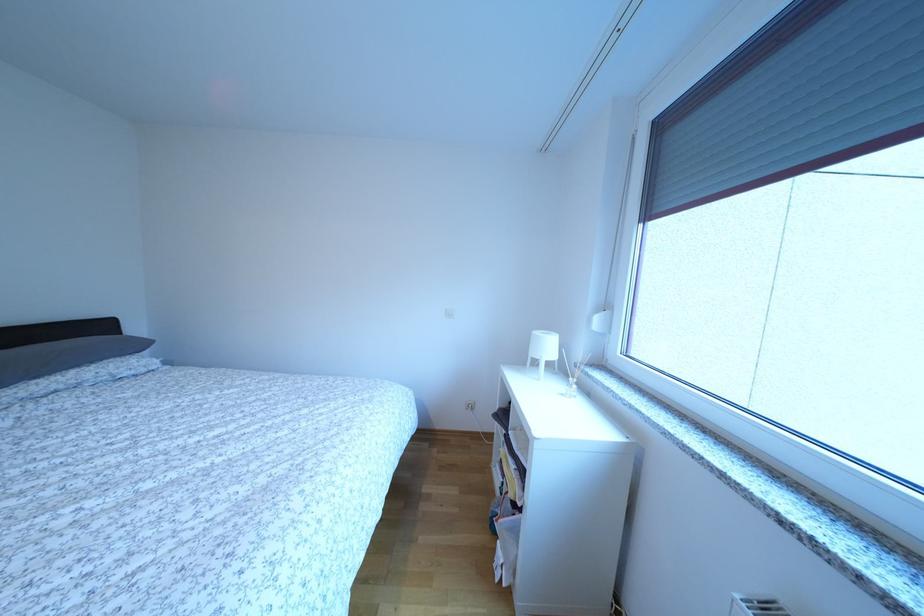
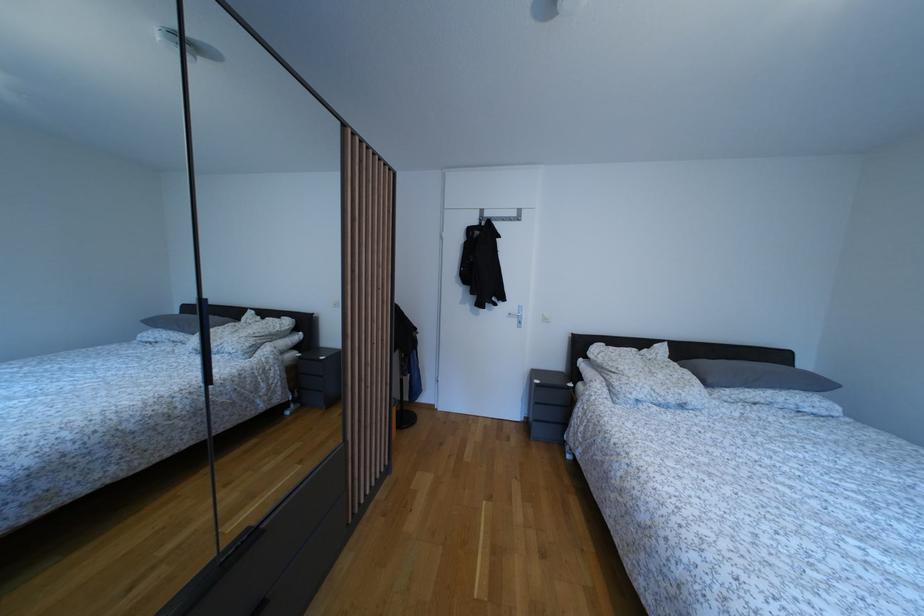
Question: How did the camera likely rotate?

Choices:
 (A) Left
 (B) Right
 (C) Up
 (D) Down

Answer: (A)